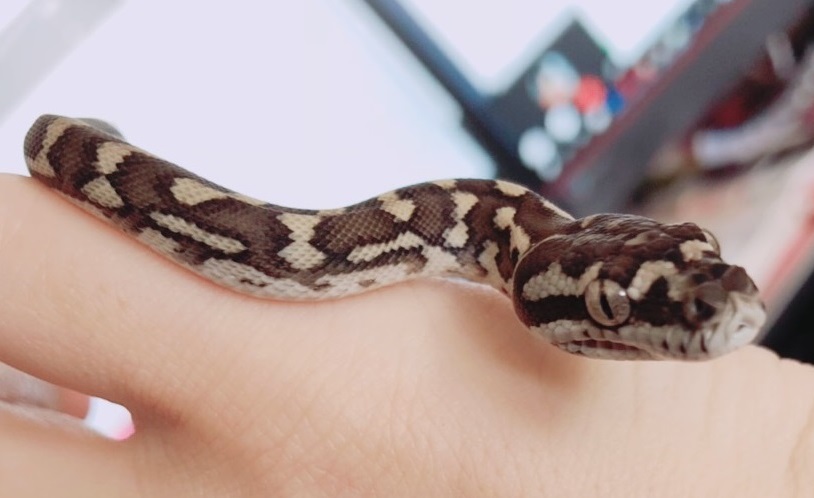
Identify the location of desk surface. (751, 224).